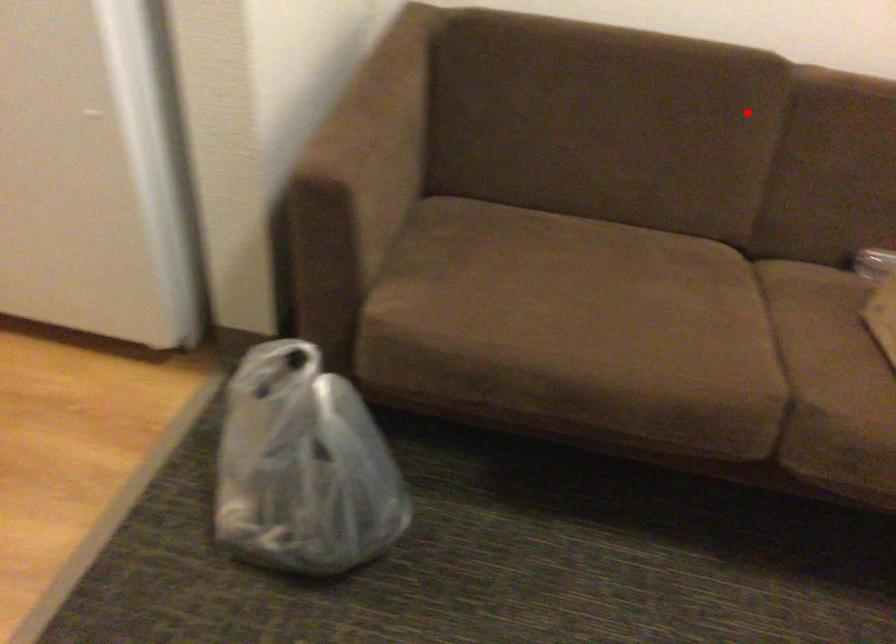
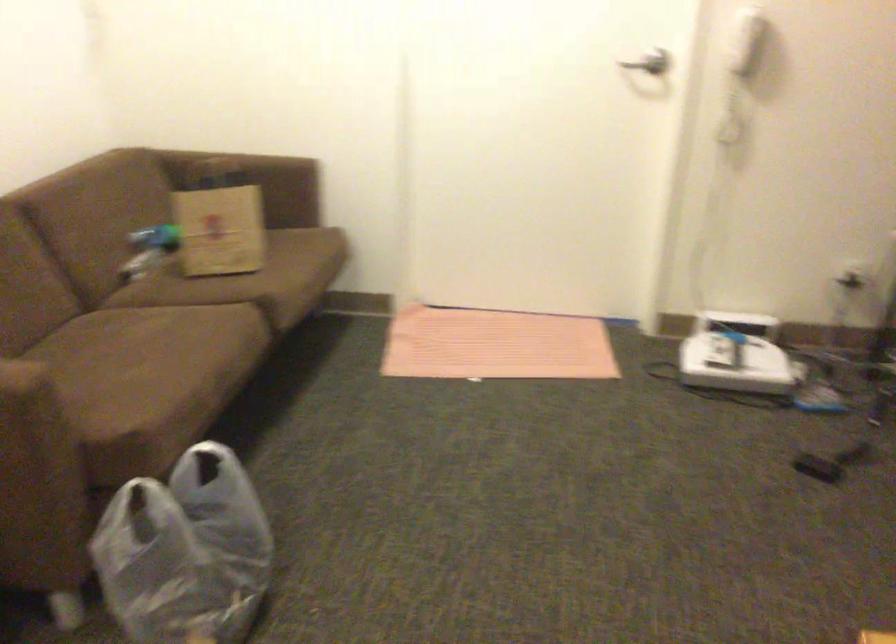
Locate, in the second image, the point that corresponds to the highlighted location in the first image.

(23, 242)